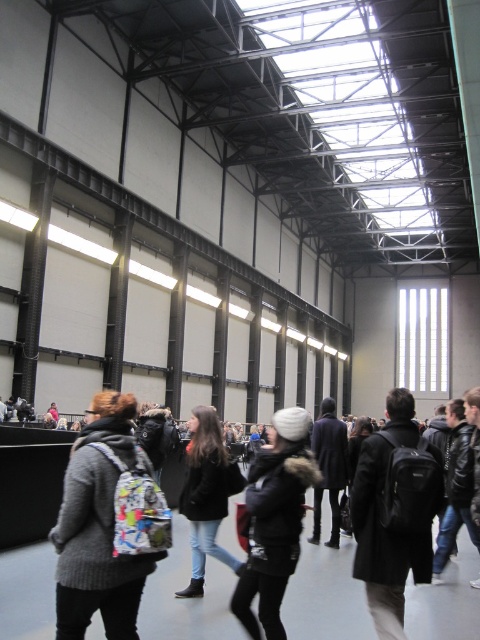
Between knitted gray sweater at center and black fuzzy jacket at center, which one has more height?

black fuzzy jacket at center is taller.

Which is in front, point (120, 604) or point (272, 625)?

Point (120, 604) is in front.

Image resolution: width=480 pixels, height=640 pixels. Identify the location of knitted gray sweater at center. [98, 525].

Who is shorter, black matte backpack at center or denim jacket at center?

black matte backpack at center is shorter.

Can you confirm if black matte backpack at center is positioned above denim jacket at center?

Yes.

Measure the distance between black matte backpack at center and camera.

The distance of black matte backpack at center from camera is 13.27 feet.

I want to click on black matte backpack at center, so click(x=395, y=515).

What do you see at coordinates (98, 525) in the screenshot?
I see `knitted gray sweater at center` at bounding box center [98, 525].

Can you confirm if knitted gray sweater at center is thinner than denim jacket at center?

Yes, knitted gray sweater at center is thinner than denim jacket at center.

This screenshot has height=640, width=480. Find the location of `knitted gray sweater at center`. knitted gray sweater at center is located at coordinates (98, 525).